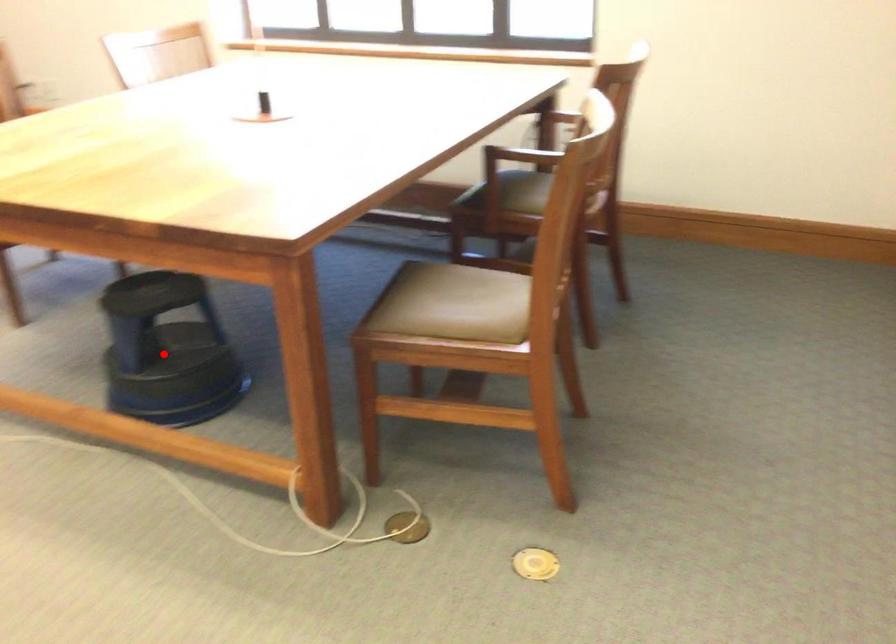
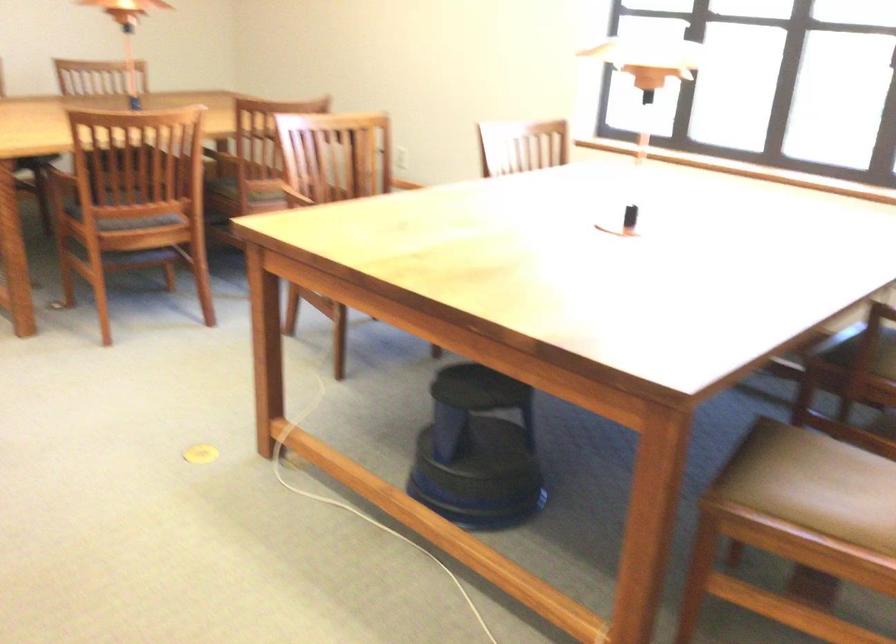
Locate, in the second image, the point that corresponds to the highlighted location in the first image.

(478, 451)